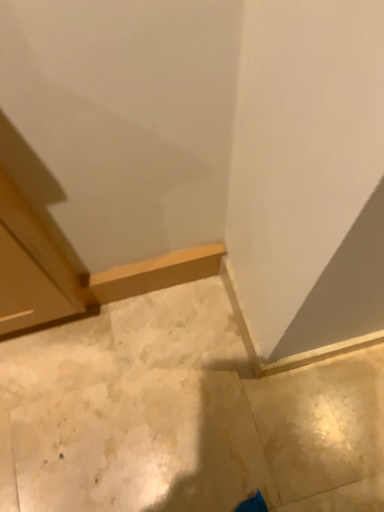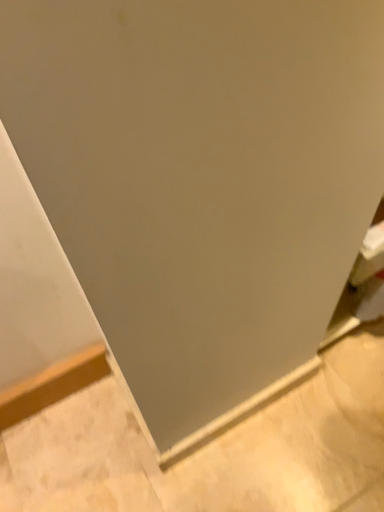
Question: How did the camera likely rotate when shooting the video?

Choices:
 (A) rotated upward
 (B) rotated downward

Answer: (A)